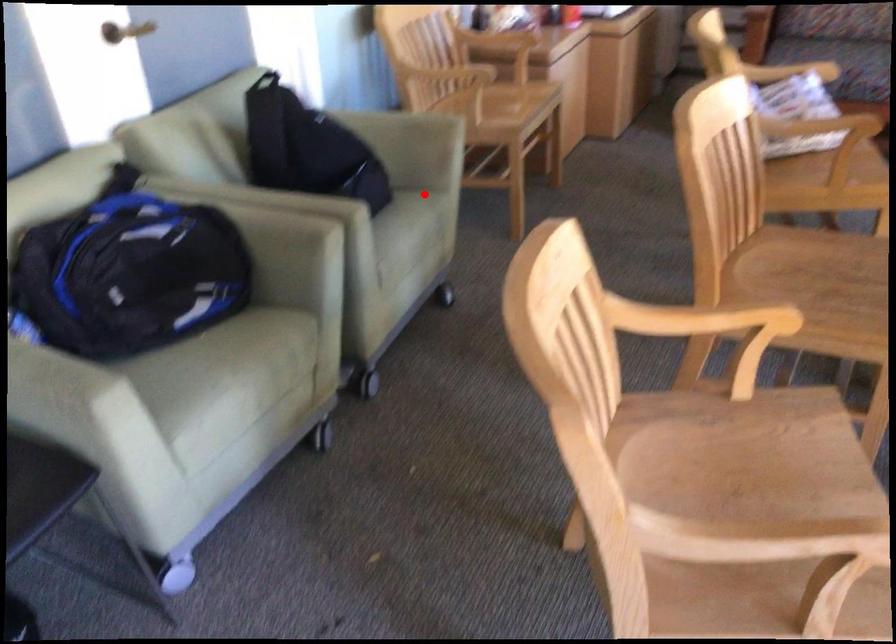
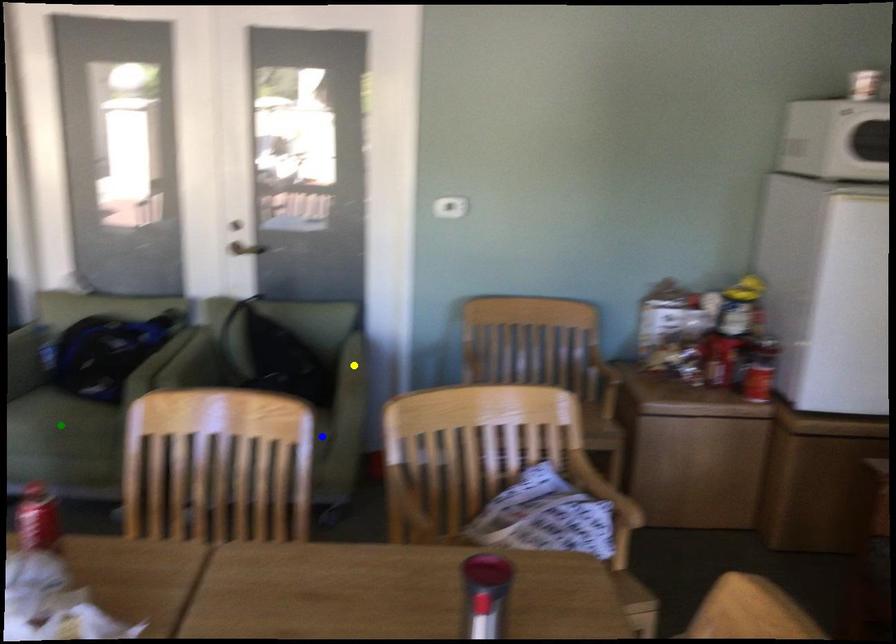
Question: I am providing you with two images of the same scene from different viewpoints. A red point is marked on the first image. You are given multiple points on the second image. Which mark in image 2 goes with the point in image 1?

Choices:
 (A) blue point
 (B) green point
 (C) yellow point

Answer: (A)